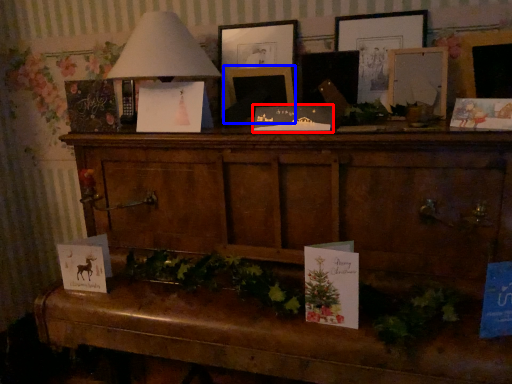
Question: Which point is further to the camera, christmas card (highlighted by a red box) or picture frame (highlighted by a blue box)?

Choices:
 (A) christmas card
 (B) picture frame

Answer: (B)